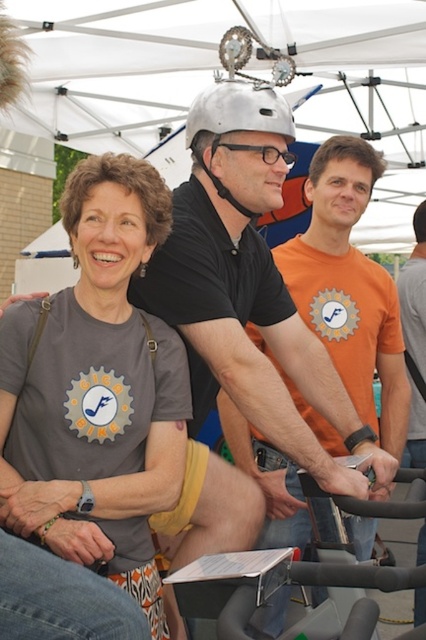
You are at an outdoor event and see the matte black helmet at center and the transparent plastic glasses at center. Which object is located lower in the image?

The matte black helmet at center is positioned under the transparent plastic glasses at center, so it is lower in the image.

Based on the photo, you are standing in front of the white canopy tent and want to take a photo of both the stationary bike and the woman. Which of the two points, point 1 at coordinates (416, 413) or point 2 at (227, 147), should you focus on first to ensure both subjects are in focus?

Point 1 at coordinates (416, 413) is further to the camera than point 2 at (227, 147). To ensure both subjects are in focus, focus on point 1 first since it is closer to the camera, and the depth of field may naturally cover the closer point 2 as well.

You are organizing a photo shoot and need to ensure that all items in the scene are visible. Given that the orange cotton shirt at center and transparent plastic glasses at center are both in the frame, which item might be more challenging to capture clearly due to its size?

The orange cotton shirt at center is bigger than transparent plastic glasses at center, so the transparent plastic glasses at center might be more challenging to capture clearly due to its smaller size.